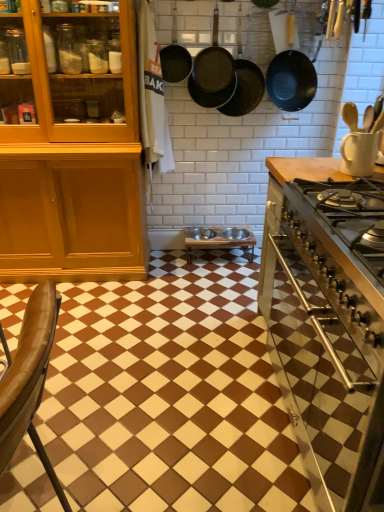
Question: Is black matte frying pan at upper center, which is the first frying pan in right-to-left order, to the left of black cast iron frying pan at upper center, the 2th frying pan viewed from the left, from the viewer's perspective?

Choices:
 (A) yes
 (B) no

Answer: (B)

Question: Can you confirm if black matte frying pan at upper center, positioned as the 4th frying pan in left-to-right order, is positioned to the right of black cast iron frying pan at upper center, which appears as the 3th frying pan when viewed from the right?

Choices:
 (A) yes
 (B) no

Answer: (A)

Question: Does black matte frying pan at upper center, positioned as the 4th frying pan in left-to-right order, turn towards black cast iron frying pan at upper center, which appears as the 3th frying pan when viewed from the right?

Choices:
 (A) no
 (B) yes

Answer: (A)

Question: Is black matte frying pan at upper center, which is the first frying pan in right-to-left order, placed right next to black cast iron frying pan at upper center, the 2th frying pan viewed from the left?

Choices:
 (A) no
 (B) yes

Answer: (A)

Question: Is the position of black matte frying pan at upper center, which is the first frying pan in right-to-left order, less distant than that of black cast iron frying pan at upper center, which appears as the 3th frying pan when viewed from the right?

Choices:
 (A) no
 (B) yes

Answer: (B)

Question: In terms of size, does metallic stainless steel stove at right appear bigger or smaller than black cast iron frying pan at upper center, the 2th frying pan viewed from the left?

Choices:
 (A) small
 (B) big

Answer: (B)

Question: Is metallic stainless steel stove at right inside the boundaries of black cast iron frying pan at upper center, which appears as the 3th frying pan when viewed from the right, or outside?

Choices:
 (A) inside
 (B) outside

Answer: (B)

Question: Is metallic stainless steel stove at right in front of or behind black cast iron frying pan at upper center, which appears as the 3th frying pan when viewed from the right, in the image?

Choices:
 (A) behind
 (B) front

Answer: (B)

Question: From the image's perspective, is metallic stainless steel stove at right above or below black cast iron frying pan at upper center, the 2th frying pan viewed from the left?

Choices:
 (A) below
 (B) above

Answer: (A)

Question: From the image's perspective, is brown glossy tile at center positioned above or below brown leather chair at lower left?

Choices:
 (A) below
 (B) above

Answer: (B)

Question: Considering the positions of brown glossy tile at center and brown leather chair at lower left in the image, is brown glossy tile at center wider or thinner than brown leather chair at lower left?

Choices:
 (A) wide
 (B) thin

Answer: (A)

Question: From a real-world perspective, is brown glossy tile at center positioned above or below brown leather chair at lower left?

Choices:
 (A) below
 (B) above

Answer: (A)

Question: Does point (198, 453) appear closer or farther from the camera than point (4, 379)?

Choices:
 (A) closer
 (B) farther

Answer: (B)

Question: Considering their positions, is wooden table at center located in front of or behind black cast iron frying pan at upper center, the 2th frying pan viewed from the left?

Choices:
 (A) behind
 (B) front

Answer: (A)

Question: Looking at their shapes, would you say wooden table at center is wider or thinner than black cast iron frying pan at upper center, which appears as the 3th frying pan when viewed from the right?

Choices:
 (A) wide
 (B) thin

Answer: (A)